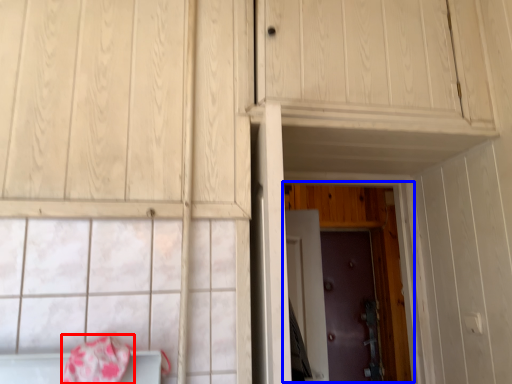
Question: Which of the following is the closest to the observer, blanket (highlighted by a red box) or door (highlighted by a blue box)?

Choices:
 (A) blanket
 (B) door

Answer: (A)